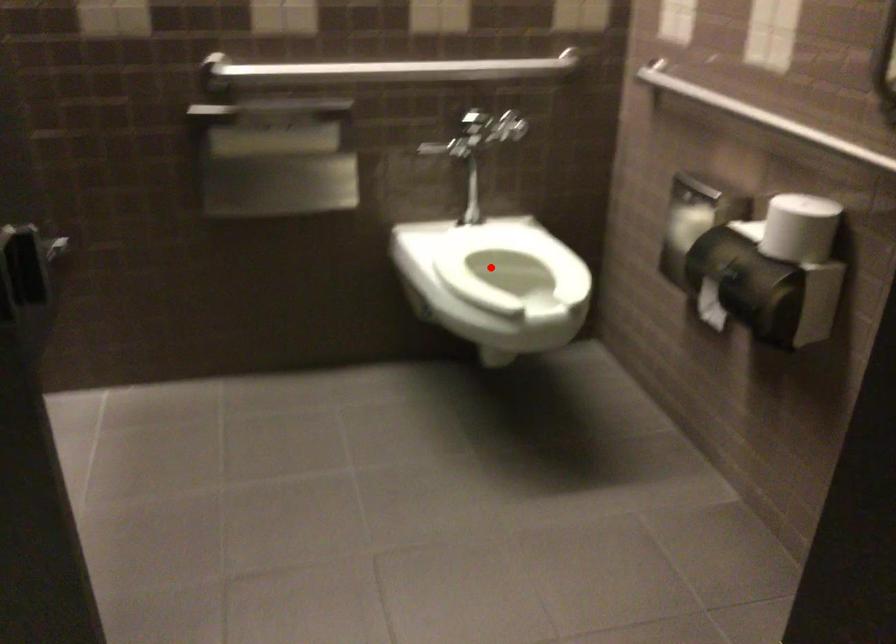
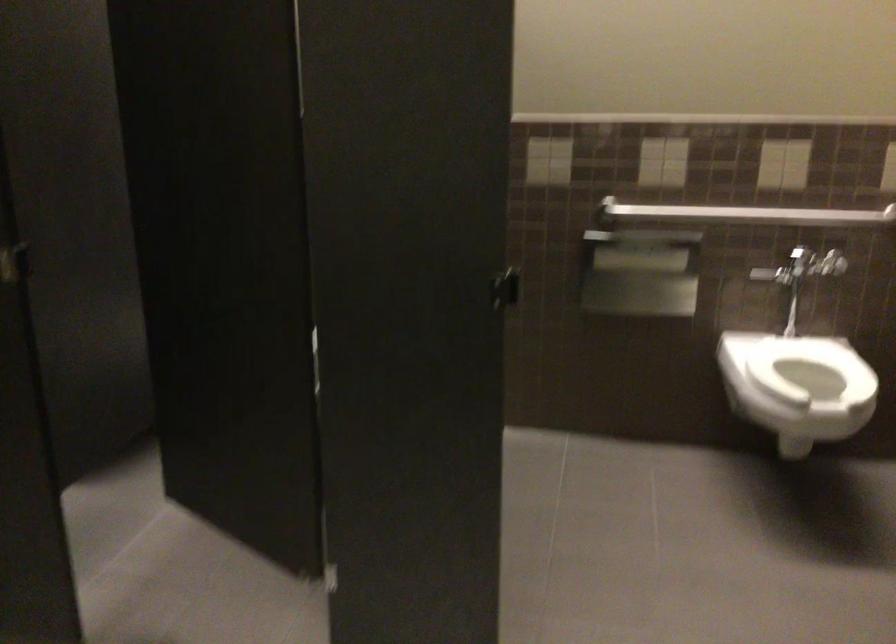
Find the pixel in the second image that matches the highlighted location in the first image.

(810, 368)